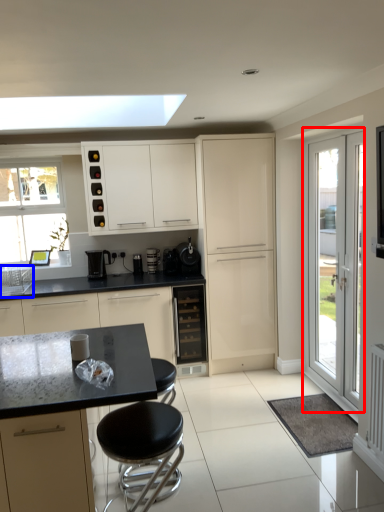
Question: Which object appears farthest to the camera in this image, door (highlighted by a red box) or sink (highlighted by a blue box)?

Choices:
 (A) door
 (B) sink

Answer: (B)